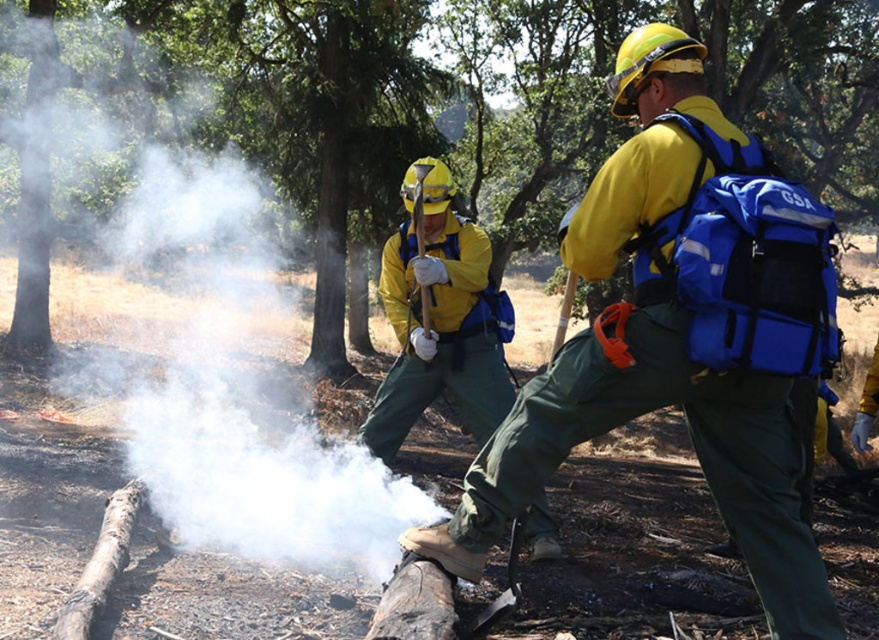
Question: Can you confirm if green textured log at center is positioned to the left of yellow matte helmet at center?

Choices:
 (A) yes
 (B) no

Answer: (B)

Question: Among these objects, which one is nearest to the camera?

Choices:
 (A) green textured log at center
 (B) yellow matte helmet at center
 (C) yellow reflective uniform at center

Answer: (C)

Question: Is green textured log at center below yellow reflective uniform at center?

Choices:
 (A) yes
 (B) no

Answer: (B)

Question: Which object is the closest to the green textured log at center?

Choices:
 (A) yellow matte safety vest at center
 (B) yellow matte helmet at center
 (C) yellow reflective uniform at center

Answer: (A)

Question: Among these objects, which one is nearest to the camera?

Choices:
 (A) yellow matte helmet at center
 (B) yellow reflective uniform at center

Answer: (B)

Question: From the image, what is the correct spatial relationship of green textured log at center in relation to yellow matte safety vest at center?

Choices:
 (A) below
 (B) above

Answer: (B)